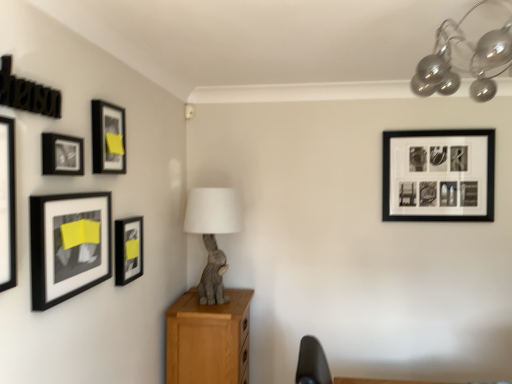
Question: Can you confirm if matte black picture frame at left, the 2th picture frame positioned from the back, is smaller than matte black picture frame at left, the fourth picture frame in the right-to-left sequence?

Choices:
 (A) yes
 (B) no

Answer: (A)

Question: Is matte black picture frame at left, the 2th picture frame positioned from the back, shorter than matte black picture frame at left, the fourth picture frame in the right-to-left sequence?

Choices:
 (A) yes
 (B) no

Answer: (A)

Question: Can you confirm if matte black picture frame at left, the 2th picture frame positioned from the back, is wider than matte black picture frame at left, the 2th picture frame positioned from the front?

Choices:
 (A) no
 (B) yes

Answer: (A)

Question: Considering the relative sizes of matte black picture frame at left, acting as the 2th picture frame starting from the right, and matte black picture frame at left, the fourth picture frame in the right-to-left sequence, in the image provided, is matte black picture frame at left, acting as the 2th picture frame starting from the right, bigger than matte black picture frame at left, the fourth picture frame in the right-to-left sequence,?

Choices:
 (A) yes
 (B) no

Answer: (B)

Question: Is matte black picture frame at left, the fourth picture frame in the right-to-left sequence, surrounded by matte black picture frame at left, which is counted as the fifth picture frame, starting from the left?

Choices:
 (A) no
 (B) yes

Answer: (A)

Question: From a real-world perspective, is matte black picture frame at left, the 2th picture frame positioned from the back, on matte black picture frame at left, the fourth picture frame in the right-to-left sequence?

Choices:
 (A) no
 (B) yes

Answer: (A)

Question: Does matte black picture frame at upper left, which ranks as the third picture frame in right-to-left order, have a greater height compared to matte black picture frame at left, the fourth picture frame in the right-to-left sequence?

Choices:
 (A) no
 (B) yes

Answer: (A)

Question: Is matte black picture frame at upper left, the 3th picture frame positioned from the back, wider than matte black picture frame at left, the 2th picture frame positioned from the front?

Choices:
 (A) no
 (B) yes

Answer: (A)

Question: Is matte black picture frame at upper left, which ranks as the third picture frame in right-to-left order, positioned beyond the bounds of matte black picture frame at left, the 2th picture frame positioned from the front?

Choices:
 (A) no
 (B) yes

Answer: (B)

Question: From the image's perspective, is matte black picture frame at upper left, the 3th picture frame positioned from the back, located beneath matte black picture frame at left, arranged as the fifth picture frame when viewed from the back?

Choices:
 (A) yes
 (B) no

Answer: (B)

Question: Does matte black picture frame at upper left, arranged as the 4th picture frame when viewed from the front, lie in front of matte black picture frame at left, the 2th picture frame positioned from the front?

Choices:
 (A) no
 (B) yes

Answer: (A)

Question: Is matte black picture frame at upper left, which ranks as the third picture frame in right-to-left order, positioned with its back to matte black picture frame at left, the fourth picture frame in the right-to-left sequence?

Choices:
 (A) no
 (B) yes

Answer: (A)

Question: Can you confirm if matte black picture frame at upper left, which is the 4th picture frame in left-to-right order, is smaller than matte black picture frame at upper left, which appears as the 5th picture frame when viewed from the right?

Choices:
 (A) no
 (B) yes

Answer: (A)